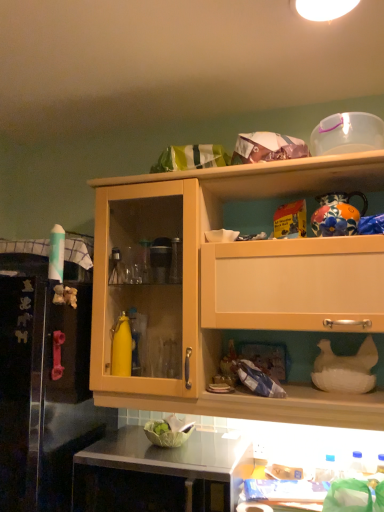
Question: Does rubber pink handle at left have a lesser height compared to wooden cabinet at upper center?

Choices:
 (A) yes
 (B) no

Answer: (B)

Question: Can you confirm if rubber pink handle at left is positioned to the right of wooden cabinet at upper center?

Choices:
 (A) yes
 (B) no

Answer: (B)

Question: Is rubber pink handle at left smaller than wooden cabinet at upper center?

Choices:
 (A) yes
 (B) no

Answer: (B)

Question: Is rubber pink handle at left to the left of wooden cabinet at upper center from the viewer's perspective?

Choices:
 (A) no
 (B) yes

Answer: (B)

Question: Considering the relative positions of rubber pink handle at left and wooden cabinet at upper center in the image provided, is rubber pink handle at left in front of wooden cabinet at upper center?

Choices:
 (A) no
 (B) yes

Answer: (B)

Question: Is rubber pink handle at left not near wooden cabinet at upper center?

Choices:
 (A) no
 (B) yes

Answer: (A)

Question: Can you confirm if white glossy light fixture at upper center is bigger than rubber pink handle at left?

Choices:
 (A) no
 (B) yes

Answer: (A)

Question: Does white glossy light fixture at upper center have a lesser width compared to rubber pink handle at left?

Choices:
 (A) no
 (B) yes

Answer: (B)

Question: Considering the relative sizes of white glossy light fixture at upper center and rubber pink handle at left in the image provided, is white glossy light fixture at upper center taller than rubber pink handle at left?

Choices:
 (A) yes
 (B) no

Answer: (B)

Question: Can you confirm if white glossy light fixture at upper center is smaller than rubber pink handle at left?

Choices:
 (A) yes
 (B) no

Answer: (A)

Question: Is white glossy light fixture at upper center facing away from rubber pink handle at left?

Choices:
 (A) no
 (B) yes

Answer: (A)

Question: Can you confirm if white glossy light fixture at upper center is wider than rubber pink handle at left?

Choices:
 (A) yes
 (B) no

Answer: (B)

Question: Is the surface of wooden cabinet at upper center in direct contact with rubber pink handle at left?

Choices:
 (A) yes
 (B) no

Answer: (B)